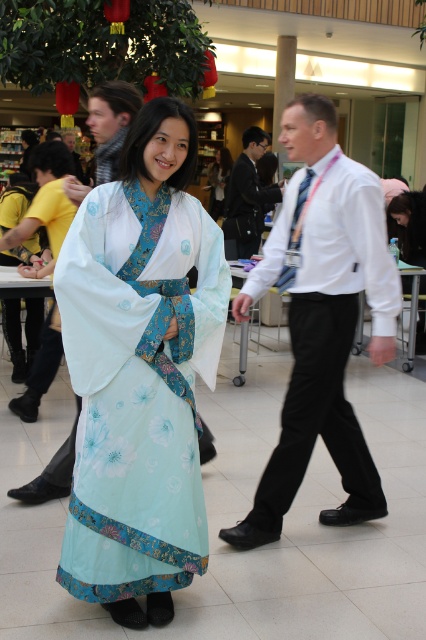
Who is taller, matte black scarf at upper left or light blue floral kimono at center?

light blue floral kimono at center is taller.

Does matte black scarf at upper left have a smaller size compared to light blue floral kimono at center?

Yes, matte black scarf at upper left is smaller than light blue floral kimono at center.

You are a GUI agent. You are given a task and a screenshot of the screen. Output one action in this format:
    pyautogui.click(x=<x>, y=<y>)
    Task: Click on the matte black scarf at upper left
    This screenshot has height=640, width=426.
    Given the screenshot: What is the action you would take?
    pyautogui.click(x=111, y=124)

Find the location of `matte black scarf at upper left`. matte black scarf at upper left is located at coordinates pos(111,124).

Is light blue floral silk dress at center shorter than matte black shirt at center?

Incorrect, light blue floral silk dress at center's height does not fall short of matte black shirt at center's.

Which is in front, point (172, 346) or point (69, 140)?

Point (172, 346)

This screenshot has height=640, width=426. Identify the location of light blue floral silk dress at center. pos(140,371).

Consider the image. Does dark blue textured suit at center appear on the left side of matte black shirt at center?

No, dark blue textured suit at center is not to the left of matte black shirt at center.

Between dark blue textured suit at center and matte black shirt at center, which one is positioned lower?

dark blue textured suit at center is below.

Is point (279, 193) closer to camera compared to point (75, 163)?

Yes, point (279, 193) is in front of point (75, 163).

Where is `dark blue textured suit at center`? This screenshot has width=426, height=640. dark blue textured suit at center is located at coordinates (247, 195).